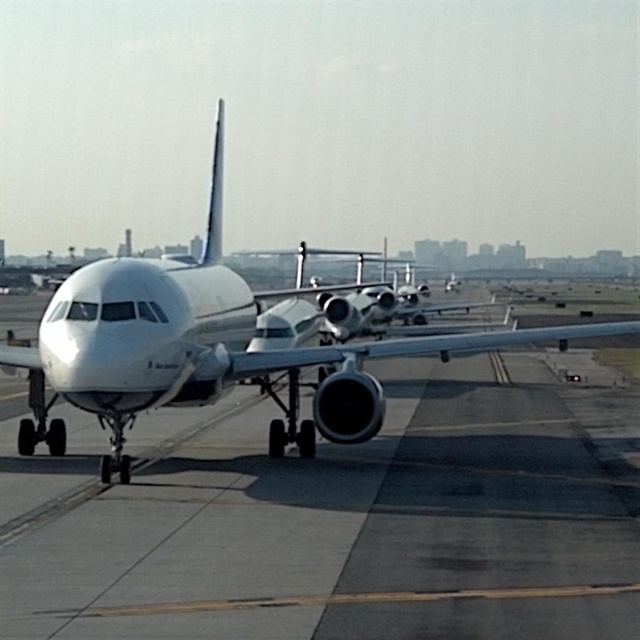
Based on the photo, does smooth concrete tarmac at center come in front of white matte airplane at center?

Yes, it is.

From the picture: Who is more forward, [156,522] or [44,352]?

Point [156,522]

I want to click on smooth concrete tarmac at center, so click(x=337, y=518).